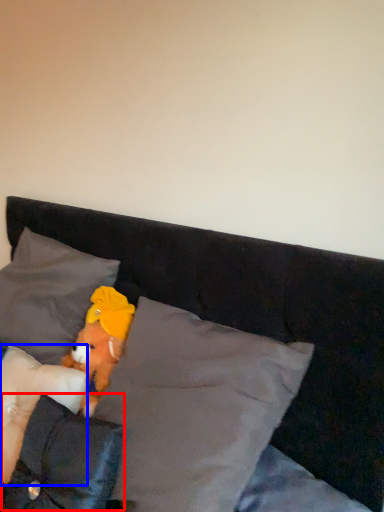
Question: Which object is further to the camera taking this photo, pillow (highlighted by a red box) or pillow (highlighted by a blue box)?

Choices:
 (A) pillow
 (B) pillow

Answer: (B)